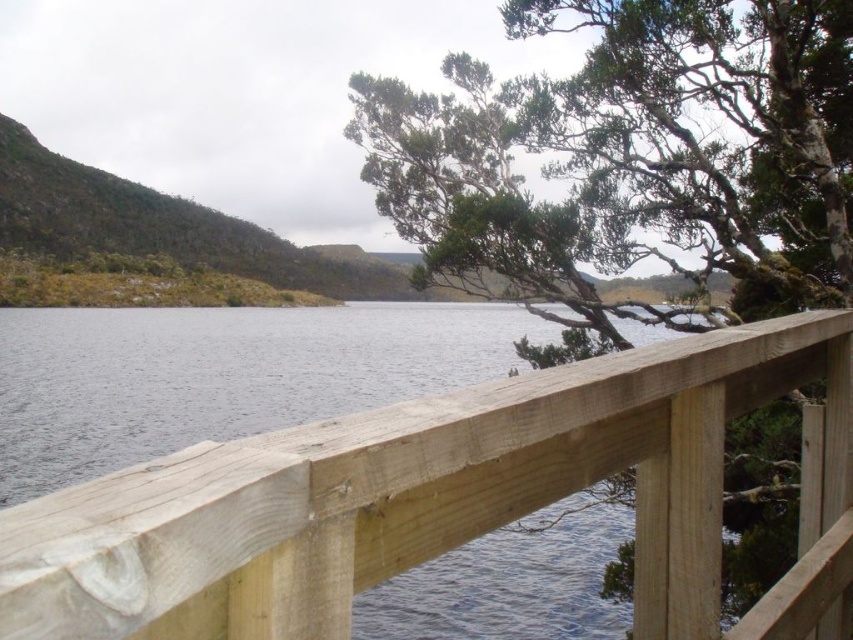
Which of these two, natural wood railing at center or green textured tree at upper center, stands shorter?

natural wood railing at center is shorter.

Is point (398, 492) positioned behind point (512, 10)?

That is False.

Between point (625, 385) and point (612, 243), which one is positioned in front?

Point (625, 385) is more forward.

This screenshot has height=640, width=853. Identify the location of natural wood railing at center. (415, 493).